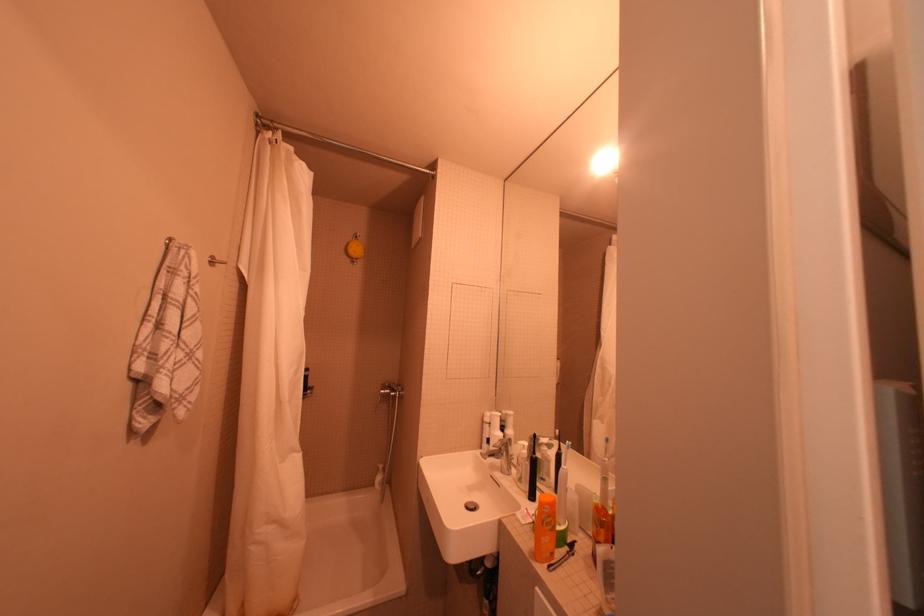
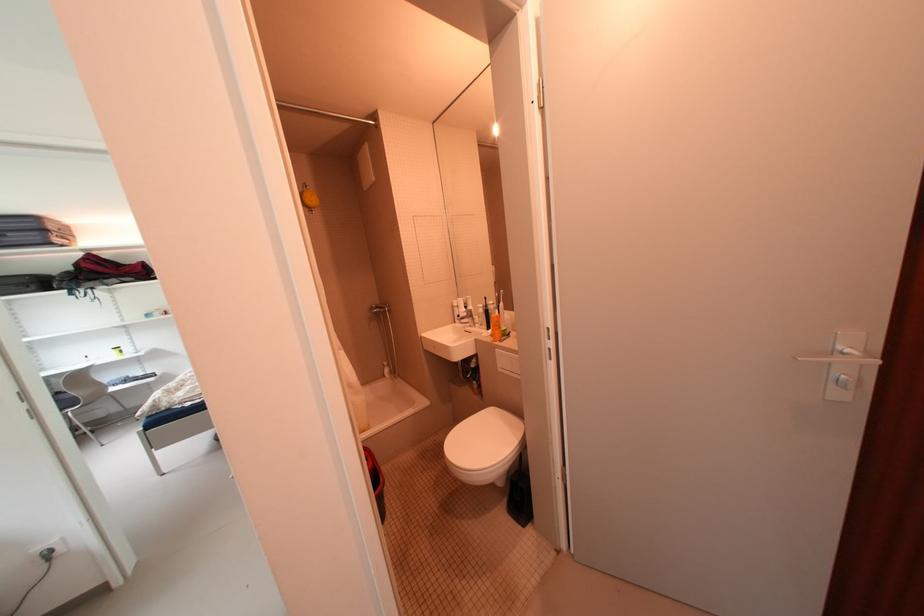
Question: I am providing you with two images of the same scene from different viewpoints. Which of the following objects are not visible in image2?

Choices:
 (A) shower control knob
 (B) white soap dispenser
 (C) red fabric bag
 (D) none of these

Answer: (D)